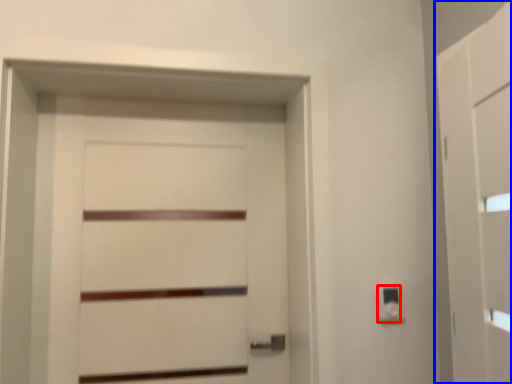
Question: Which object appears closest to the camera in this image, light switch (highlighted by a red box) or barn door (highlighted by a blue box)?

Choices:
 (A) light switch
 (B) barn door

Answer: (B)